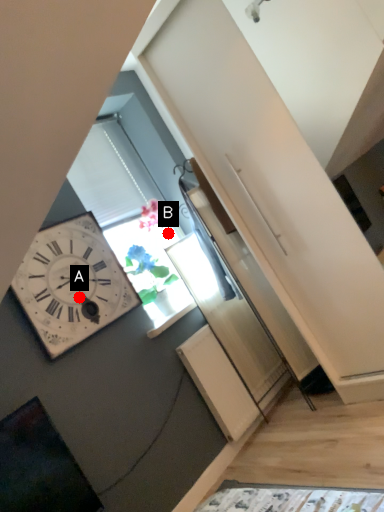
Question: Two points are circled on the image, labeled by A and B beside each circle. Which point appears farthest from the camera in this image?

Choices:
 (A) A is further
 (B) B is further

Answer: (B)